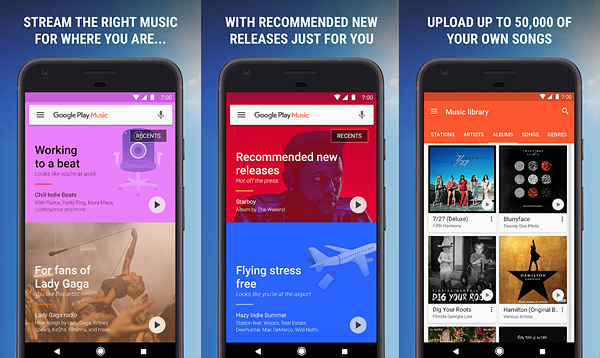
The image size is (600, 358). In order to click on device home button in this screenshot , I will do `click(98, 350)`, `click(302, 347)`, `click(497, 352)`.